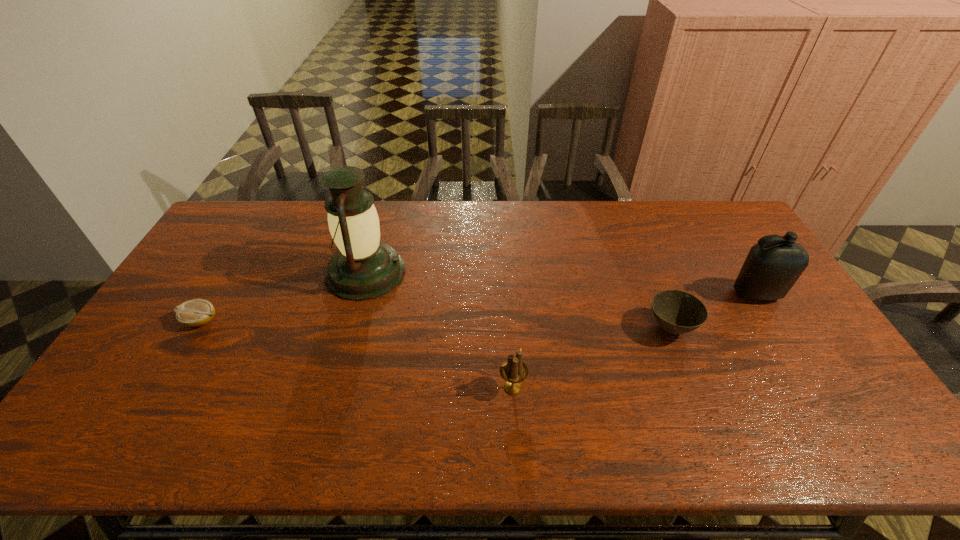
This screenshot has width=960, height=540. In order to click on vacant space at the near right corner in this screenshot , I will do `click(823, 441)`.

Identify the location of empty space that is in between the second object from right to left and the lantern. (518, 300).

Where is `free space between the second object from right to left and the second object from left to right`? The height and width of the screenshot is (540, 960). free space between the second object from right to left and the second object from left to right is located at coordinates (518, 300).

Image resolution: width=960 pixels, height=540 pixels. I want to click on free space between the fourth object from right to left and the lemon, so click(x=283, y=296).

The height and width of the screenshot is (540, 960). Find the location of `empty location between the shortest object and the rightmost object`. empty location between the shortest object and the rightmost object is located at coordinates (478, 308).

Image resolution: width=960 pixels, height=540 pixels. I want to click on vacant point located between the bottle and the leftmost object, so click(x=478, y=308).

Locate an element on the screen. The image size is (960, 540). free point between the third tallest object and the leftmost object is located at coordinates (356, 354).

Identify the location of blank region between the third tallest object and the lemon. (356, 354).

Find the location of `free space between the fourth object from right to left and the shortest object`. free space between the fourth object from right to left and the shortest object is located at coordinates (283, 296).

At what (x,y) coordinates should I click in order to perform the action: click on vacant space that's between the lemon and the second object from right to left. Please return your answer as a coordinate pair (x, y). Looking at the image, I should click on (436, 325).